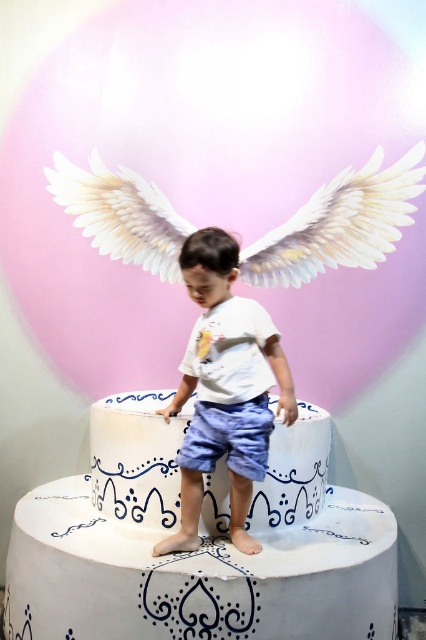
From the picture: Does white painted cake at center appear on the left side of white glossy cake at center?

Indeed, white painted cake at center is positioned on the left side of white glossy cake at center.

Is point (356, 522) positioned behind point (97, 440)?

That is False.

Where is `white painted cake at center`? The height and width of the screenshot is (640, 426). white painted cake at center is located at coordinates (201, 547).

Where is `white painted cake at center`? The width and height of the screenshot is (426, 640). white painted cake at center is located at coordinates (201, 547).

Which is more to the left, white feathered wings at upper center or white glossy cake at center?

white glossy cake at center is more to the left.

Who is lower down, white feathered wings at upper center or white glossy cake at center?

white glossy cake at center is below.

Is point (178, 237) in front of point (157, 483)?

No, it is behind (157, 483).

This screenshot has width=426, height=640. In order to click on white feathered wings at upper center in this screenshot , I will do `click(339, 225)`.

Can you confirm if white painted cake at center is smaller than white feathered wings at upper center?

No.

Who is more distant from viewer, [40,634] or [334,253]?

The point [334,253] is behind.

What are the coordinates of `white painted cake at center` in the screenshot? It's located at (201, 547).